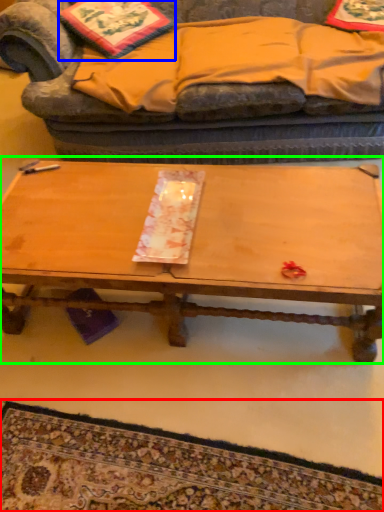
Question: Based on their relative distances, which object is farther from mat (highlighted by a red box)? Choose from pillow (highlighted by a blue box) and coffee table (highlighted by a green box).

Choices:
 (A) pillow
 (B) coffee table

Answer: (A)